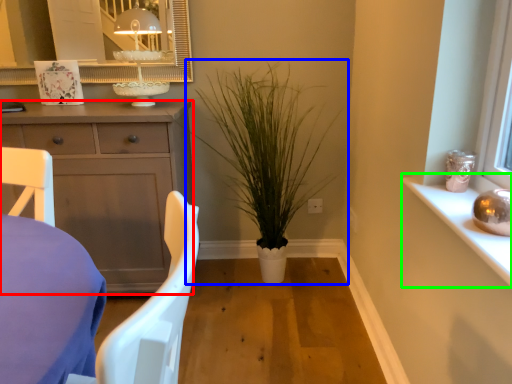
Question: Considering the real-world distances, which object is farthest from cabinetry (highlighted by a red box)? houseplant (highlighted by a blue box) or window sill (highlighted by a green box)?

Choices:
 (A) houseplant
 (B) window sill

Answer: (B)